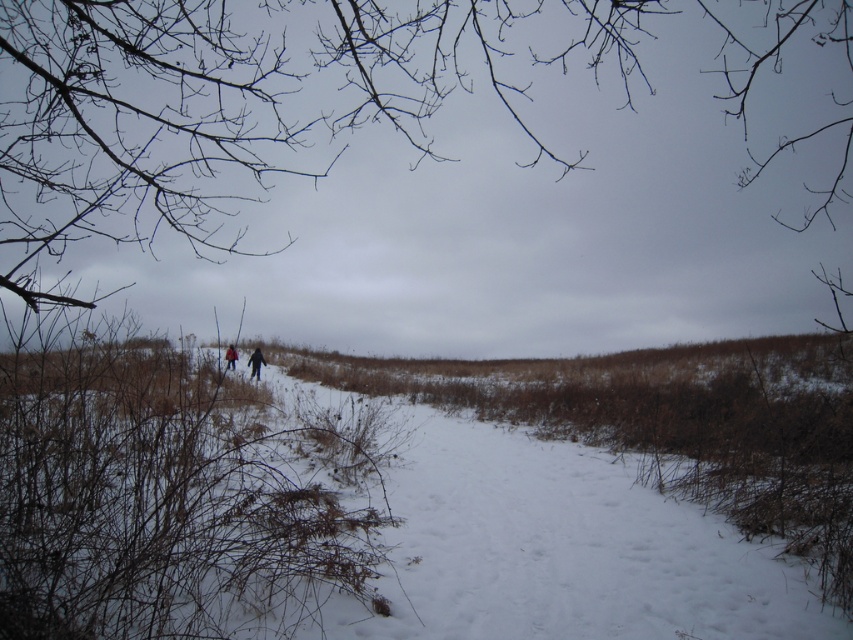
You are standing at the starting point of the path and see the white powdery snow at center and the dark blue jacket at center. Which object is closer to you?

The dark blue jacket at center is closer to you because the white powdery snow at center is 48.04 feet away from it, meaning the jacket is nearer than the snow.

You are standing at the point with coordinates point (236, 355) and want to walk towards the point with coordinates point (236, 483). Given the snow conditions described in the scene, will you be walking uphill or downhill?

Since point (236, 483) is closer to the camera than point (236, 355), this indicates that point (236, 483) is physically closer to you. Therefore, walking from point (236, 355) to point (236, 483) means you are moving towards a location that is nearer to your current position. This implies that you are walking downhill because you are moving towards a lower elevation relative to your starting point.